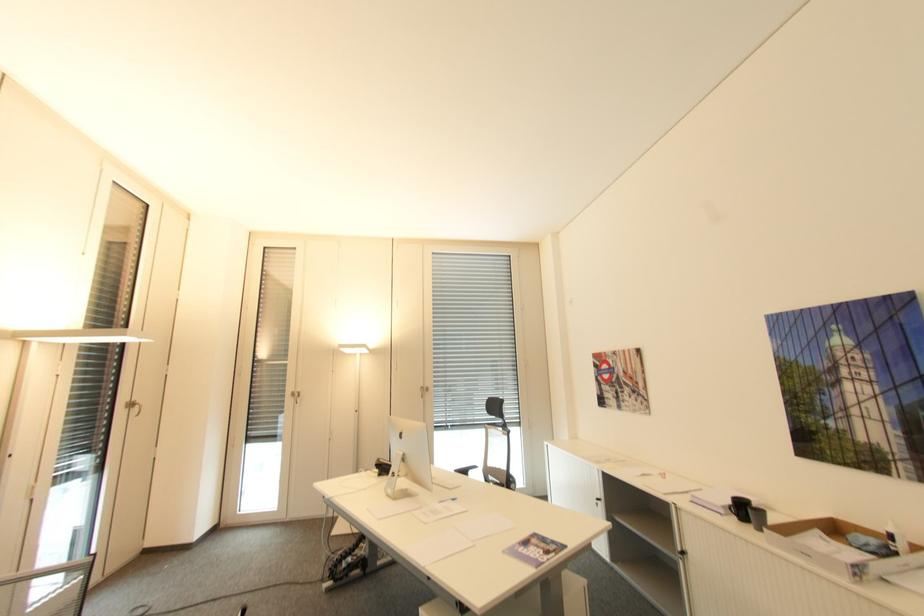
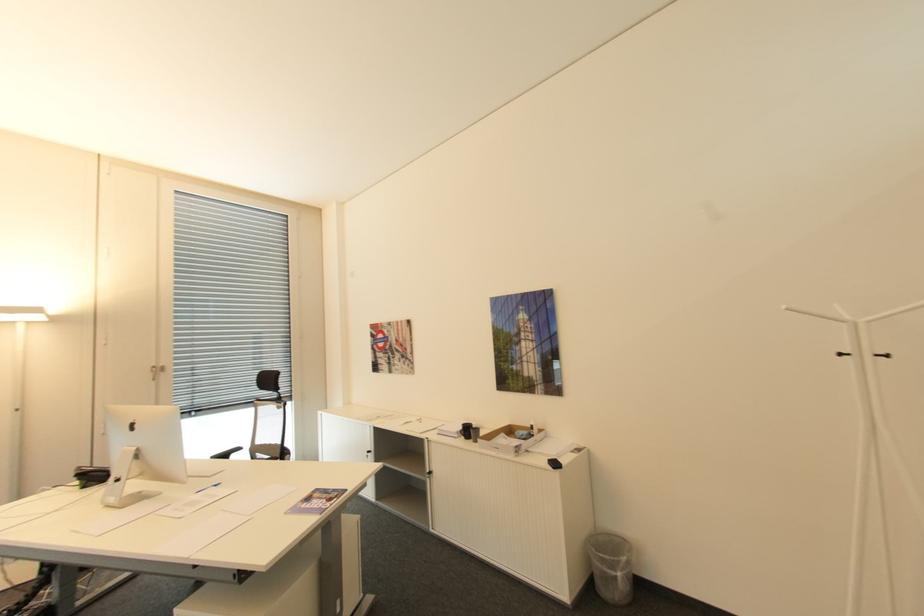
Where in the second image is the point corresponding to [427,387] from the first image?

(159, 367)